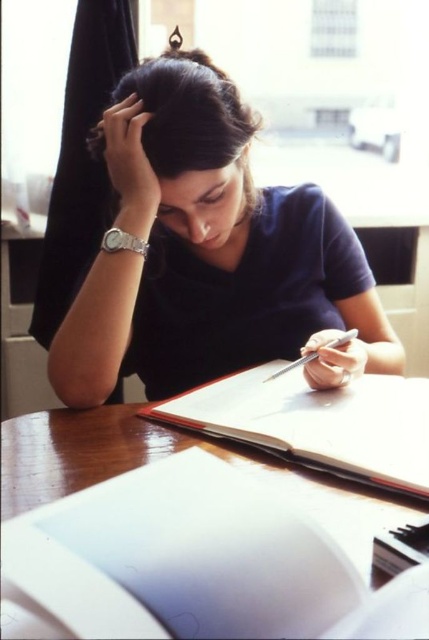
Question: Is dark blue shirt at center further to camera compared to metallic silver pen at center?

Choices:
 (A) no
 (B) yes

Answer: (A)

Question: Is white paper notebook at center positioned in front of dark brown hair at center?

Choices:
 (A) no
 (B) yes

Answer: (B)

Question: Which of the following is the farthest from the observer?

Choices:
 (A) dark blue shirt at center
 (B) dark brown hair at center
 (C) wooden table at center
 (D) white paper notebook at center

Answer: (A)

Question: Which of these objects is positioned farthest from the metallic silver pen at center?

Choices:
 (A) white paper notebook at center
 (B) dark brown hair at center
 (C) wooden table at center
 (D) dark blue shirt at center

Answer: (B)

Question: Can you confirm if white paper notebook at center is wider than dark brown hair at center?

Choices:
 (A) yes
 (B) no

Answer: (A)

Question: Estimate the real-world distances between objects in this image. Which object is farther from the white paper notebook at center?

Choices:
 (A) wooden table at center
 (B) dark brown hair at center
 (C) dark blue shirt at center
 (D) metallic silver pen at center

Answer: (B)